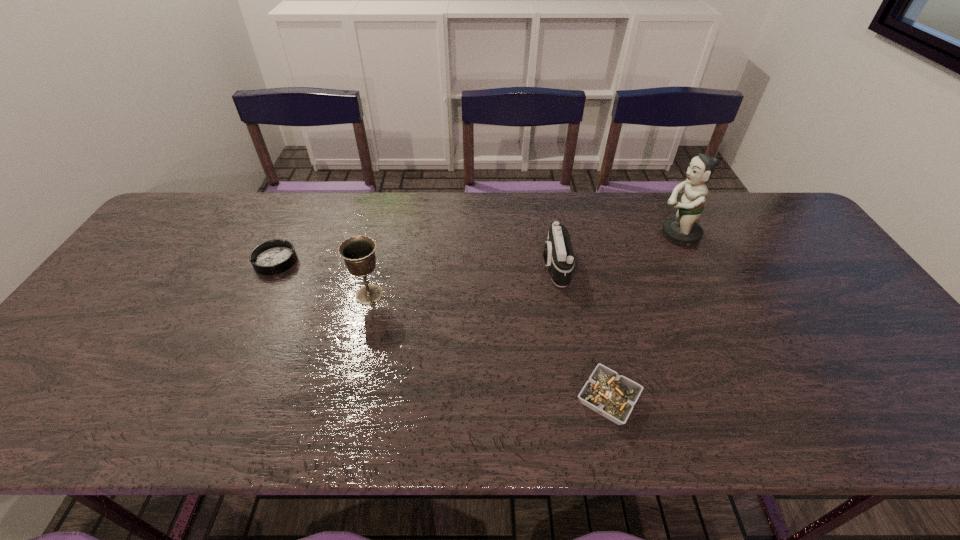
Locate an element on the screen. The image size is (960, 540). blank space at the far edge of the desktop is located at coordinates (408, 199).

Where is `vacant space at the near edge`? This screenshot has width=960, height=540. vacant space at the near edge is located at coordinates (93, 404).

At what (x,y) coordinates should I click in order to perform the action: click on vacant area at the left edge. Please return your answer as a coordinate pair (x, y). The image size is (960, 540). Looking at the image, I should click on (131, 270).

In the image, there is a desktop. Find the location of `free region at the far right corner`. free region at the far right corner is located at coordinates (763, 233).

Find the location of a particular element. The height and width of the screenshot is (540, 960). free space between the farther ashtray and the rightmost object is located at coordinates coord(477,248).

The width and height of the screenshot is (960, 540). Identify the location of vacant area that lies between the nearer ashtray and the left ashtray. (442, 330).

This screenshot has width=960, height=540. In order to click on unoccupied position between the second object from left to right and the left ashtray in this screenshot , I will do `click(323, 278)`.

Identify the location of vacant space that's between the leftmost object and the nearer ashtray. This screenshot has height=540, width=960. (442, 330).

At what (x,y) coordinates should I click in order to perform the action: click on vacant region between the rightmost object and the third tallest object. Please return your answer as a coordinate pair (x, y). Image resolution: width=960 pixels, height=540 pixels. Looking at the image, I should click on (616, 251).

What are the coordinates of `free area in between the leftmost object and the figurine` in the screenshot? It's located at pyautogui.click(x=477, y=248).